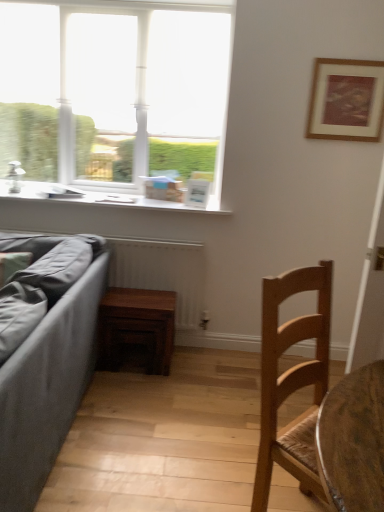
Question: Considering the relative positions of wooden radiator at lower left and wooden framed artwork at upper right in the image provided, is wooden radiator at lower left to the left of wooden framed artwork at upper right from the viewer's perspective?

Choices:
 (A) yes
 (B) no

Answer: (A)

Question: Considering the relative sizes of wooden radiator at lower left and wooden framed artwork at upper right in the image provided, is wooden radiator at lower left smaller than wooden framed artwork at upper right?

Choices:
 (A) yes
 (B) no

Answer: (B)

Question: Does wooden radiator at lower left touch wooden framed artwork at upper right?

Choices:
 (A) yes
 (B) no

Answer: (B)

Question: Considering the relative positions of wooden radiator at lower left and wooden framed artwork at upper right in the image provided, is wooden radiator at lower left behind wooden framed artwork at upper right?

Choices:
 (A) no
 (B) yes

Answer: (B)

Question: Is the depth of wooden radiator at lower left less than that of wooden framed artwork at upper right?

Choices:
 (A) no
 (B) yes

Answer: (A)

Question: In terms of size, does wooden framed artwork at upper right appear bigger or smaller than wooden radiator at lower left?

Choices:
 (A) big
 (B) small

Answer: (B)

Question: Choose the correct answer: Is wooden framed artwork at upper right inside wooden radiator at lower left or outside it?

Choices:
 (A) outside
 (B) inside

Answer: (A)

Question: Considering the positions of point (350, 106) and point (157, 245), is point (350, 106) closer or farther from the camera than point (157, 245)?

Choices:
 (A) closer
 (B) farther

Answer: (A)

Question: From a real-world perspective, is wooden framed artwork at upper right above or below wooden radiator at lower left?

Choices:
 (A) above
 (B) below

Answer: (A)

Question: Considering the positions of dark wood table at center and wooden radiator at lower left in the image, is dark wood table at center taller or shorter than wooden radiator at lower left?

Choices:
 (A) tall
 (B) short

Answer: (B)

Question: From a real-world perspective, relative to wooden radiator at lower left, is dark wood table at center vertically above or below?

Choices:
 (A) below
 (B) above

Answer: (A)

Question: Is dark wood table at center to the left or to the right of wooden radiator at lower left in the image?

Choices:
 (A) left
 (B) right

Answer: (B)

Question: Looking at their shapes, would you say dark wood table at center is wider or thinner than wooden radiator at lower left?

Choices:
 (A) wide
 (B) thin

Answer: (A)

Question: From a real-world perspective, is white glass window at upper left physically located above or below wooden chair at lower right?

Choices:
 (A) below
 (B) above

Answer: (B)

Question: From the image's perspective, is white glass window at upper left located above or below wooden chair at lower right?

Choices:
 (A) above
 (B) below

Answer: (A)